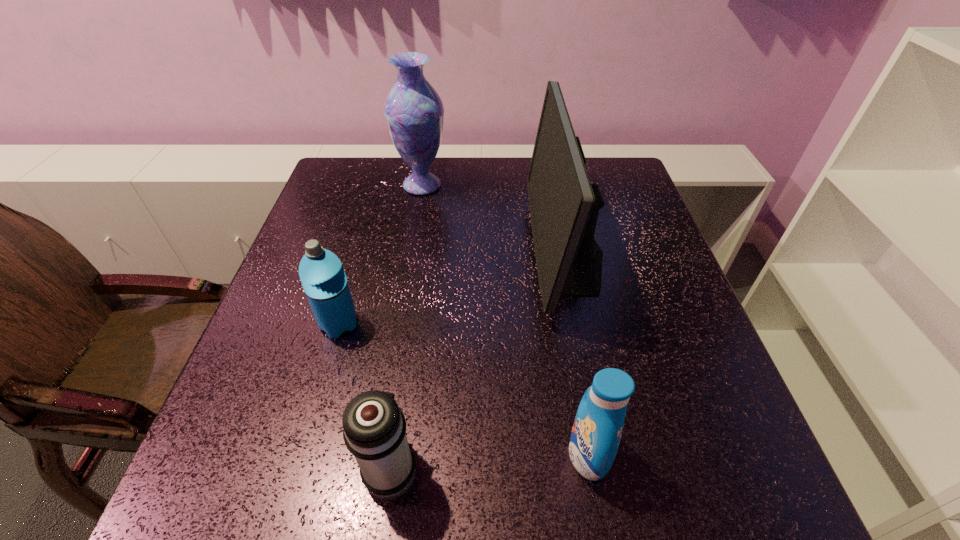
This screenshot has width=960, height=540. I want to click on vase, so click(414, 112).

At what (x,y) coordinates should I click in order to perform the action: click on computer monitor. Please return your answer as a coordinate pair (x, y). Looking at the image, I should click on (564, 205).

Where is `the left thermos bottle`? the left thermos bottle is located at coordinates (322, 275).

Locate an element on the screen. Image resolution: width=960 pixels, height=540 pixels. the farther thermos bottle is located at coordinates (322, 275).

This screenshot has width=960, height=540. In order to click on detergent in this screenshot , I will do `click(597, 429)`.

Where is `the right thermos bottle`? This screenshot has height=540, width=960. the right thermos bottle is located at coordinates point(374,428).

Identify the location of free location located 0.210m on the right of the vase. The image size is (960, 540). (521, 185).

This screenshot has width=960, height=540. I want to click on vacant space situated 0.370m on the screen side of the computer monitor, so click(x=379, y=254).

Find the location of `free space located on the screen side of the computer monitor`. free space located on the screen side of the computer monitor is located at coordinates (387, 254).

You are a GUI agent. You are given a task and a screenshot of the screen. Output one action in this format:
    pyautogui.click(x=<x>, y=<y>)
    Task: Click on the vacant point located 0.320m on the screen side of the computer monitor
    The image size is (960, 540).
    Given the screenshot: What is the action you would take?
    pyautogui.click(x=399, y=254)